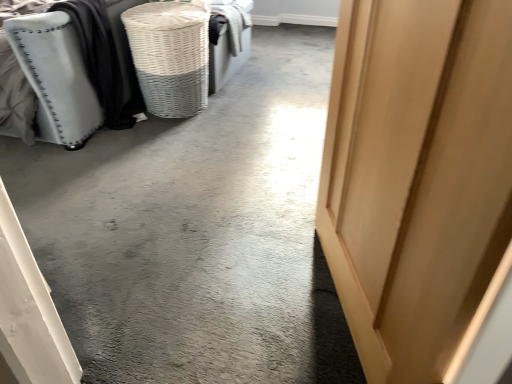
Question: Is white wicker basket at upper left not close to light wood door at center right?

Choices:
 (A) no
 (B) yes

Answer: (B)

Question: Is white wicker basket at upper left surrounding light wood door at center right?

Choices:
 (A) no
 (B) yes

Answer: (A)

Question: Is the depth of white wicker basket at upper left less than that of light wood door at center right?

Choices:
 (A) yes
 (B) no

Answer: (B)

Question: Is white wicker basket at upper left oriented away from light wood door at center right?

Choices:
 (A) yes
 (B) no

Answer: (B)

Question: Considering the relative sizes of white wicker basket at upper left and light wood door at center right in the image provided, is white wicker basket at upper left taller than light wood door at center right?

Choices:
 (A) yes
 (B) no

Answer: (B)

Question: Is matte gray fabric ottoman at left taller or shorter than light wood door at center right?

Choices:
 (A) tall
 (B) short

Answer: (B)

Question: From a real-world perspective, is matte gray fabric ottoman at left physically located above or below light wood door at center right?

Choices:
 (A) below
 (B) above

Answer: (A)

Question: In the image, is matte gray fabric ottoman at left positioned in front of or behind light wood door at center right?

Choices:
 (A) front
 (B) behind

Answer: (B)

Question: Would you say matte gray fabric ottoman at left is inside or outside light wood door at center right?

Choices:
 (A) outside
 (B) inside

Answer: (A)

Question: Is light wood door at center right taller or shorter than matte gray fabric ottoman at left?

Choices:
 (A) short
 (B) tall

Answer: (B)

Question: Is point (386, 130) closer or farther from the camera than point (116, 21)?

Choices:
 (A) closer
 (B) farther

Answer: (A)

Question: From a real-world perspective, relative to matte gray fabric ottoman at left, is light wood door at center right vertically above or below?

Choices:
 (A) above
 (B) below

Answer: (A)

Question: From the image's perspective, is light wood door at center right positioned above or below matte gray fabric ottoman at left?

Choices:
 (A) above
 (B) below

Answer: (B)

Question: Considering the positions of point (346, 213) and point (181, 51), is point (346, 213) closer or farther from the camera than point (181, 51)?

Choices:
 (A) closer
 (B) farther

Answer: (A)

Question: Considering the relative positions of light wood door at center right and white wicker basket at upper left in the image provided, is light wood door at center right to the left or to the right of white wicker basket at upper left?

Choices:
 (A) left
 (B) right

Answer: (B)